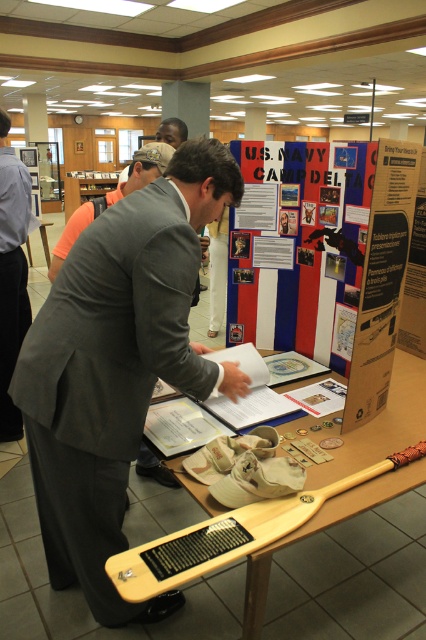
Which is behind, point (6, 237) or point (144, 180)?

Point (6, 237)

Is point (8, 156) less distant than point (118, 193)?

That is False.

Is point (20, 310) more distant than point (131, 179)?

That is True.

The image size is (426, 640). In order to click on gray suit jacket at center in this screenshot , I will do `click(11, 273)`.

Is matte paper poster at center smaller than gray suit jacket at center?

No, matte paper poster at center is not smaller than gray suit jacket at center.

Which of these two, matte paper poster at center or gray suit jacket at center, stands taller?

With more height is gray suit jacket at center.

At what (x,y) coordinates should I click in order to perform the action: click on matte paper poster at center. Please return your answer as a coordinate pair (x, y). Looking at the image, I should click on (298, 244).

Does point (106, 422) come behind point (17, 276)?

No, (106, 422) is closer to viewer.

This screenshot has height=640, width=426. Find the location of `gray wool business suit at center`. gray wool business suit at center is located at coordinates [x=106, y=380].